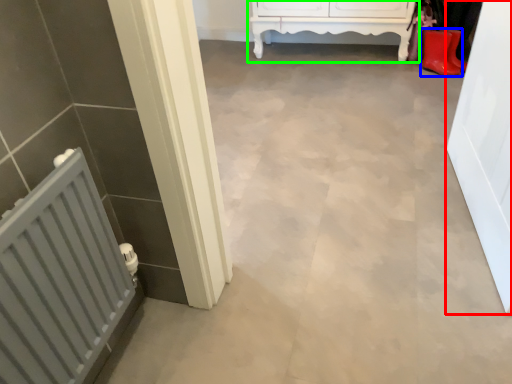
Question: Which object is the farthest from door (highlighted by a red box)? Choose among these: footwear (highlighted by a blue box) or furniture (highlighted by a green box).

Choices:
 (A) footwear
 (B) furniture

Answer: (B)